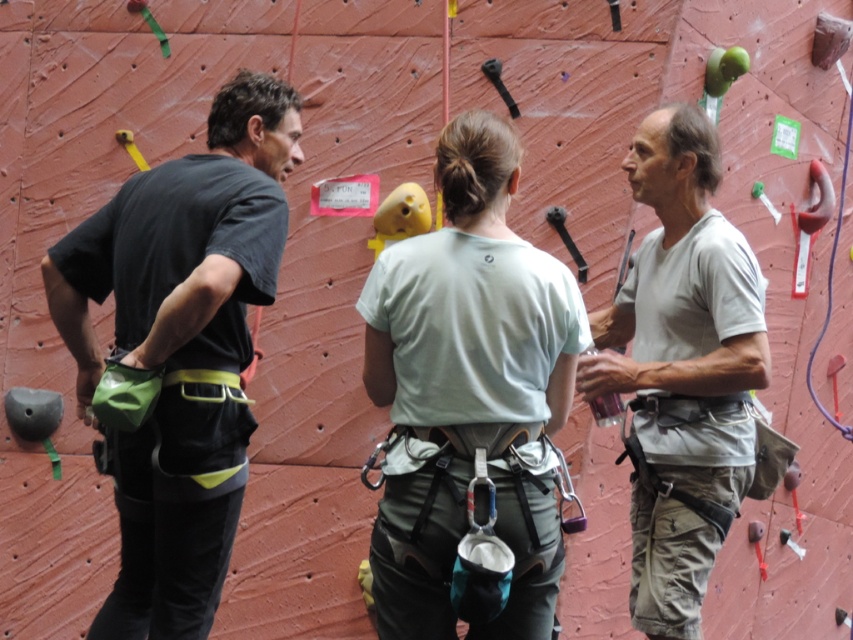
Question: Is green fabric climbing harness at left wider than light green fabric shirt at center?

Choices:
 (A) yes
 (B) no

Answer: (A)

Question: Which point is closer to the camera taking this photo?

Choices:
 (A) (694, 288)
 (B) (285, 100)
 (C) (378, 628)

Answer: (C)

Question: Is green fabric climbing harness at left positioned behind gray cotton shirt at center?

Choices:
 (A) no
 (B) yes

Answer: (A)

Question: Which object is farther from the camera taking this photo?

Choices:
 (A) green fabric climbing harness at left
 (B) gray cotton shirt at center

Answer: (B)

Question: Can you confirm if green fabric climbing harness at left is positioned to the right of gray cotton shirt at center?

Choices:
 (A) yes
 (B) no

Answer: (B)

Question: Which of the following is the closest to the observer?

Choices:
 (A) (186, 477)
 (B) (512, 611)

Answer: (B)